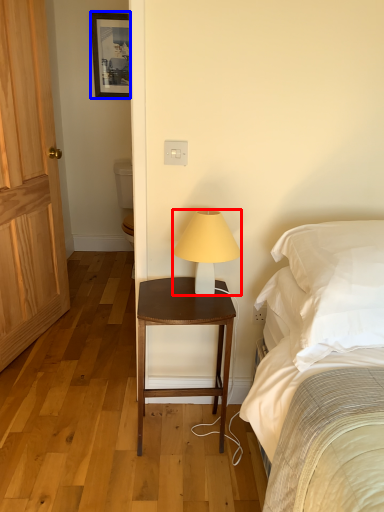
Question: Which of the following is the farthest to the observer, lamp (highlighted by a red box) or picture frame (highlighted by a blue box)?

Choices:
 (A) lamp
 (B) picture frame

Answer: (B)